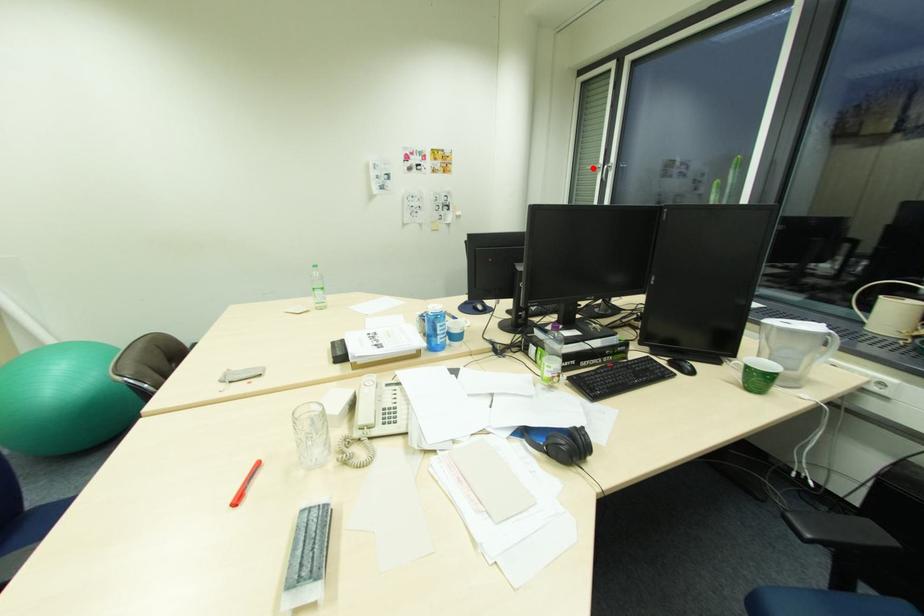
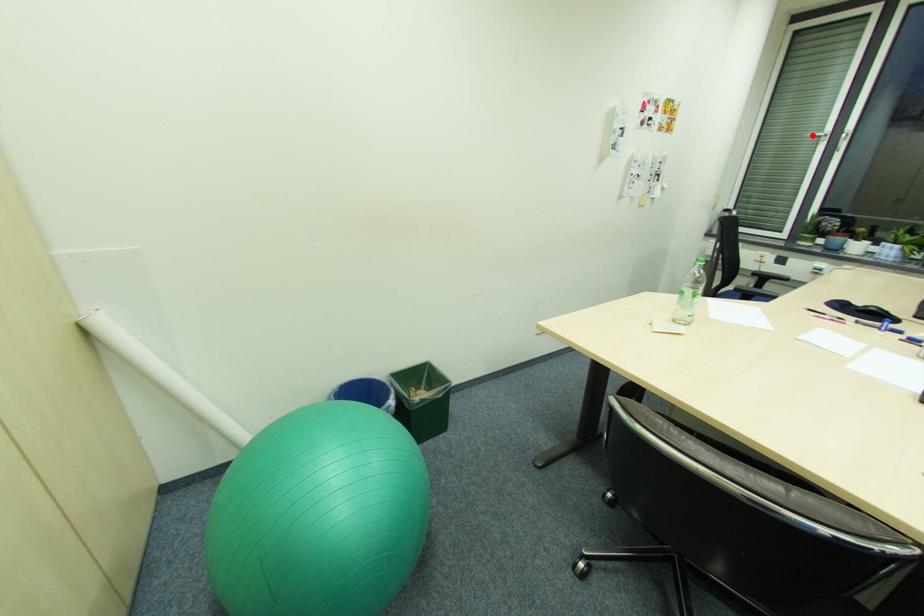
I am providing you with two images of the same scene from different viewpoints. A red point is marked on the first image and another point is marked on the second image. Is the marked point in image1 the same physical position as the marked point in image2?

Yes